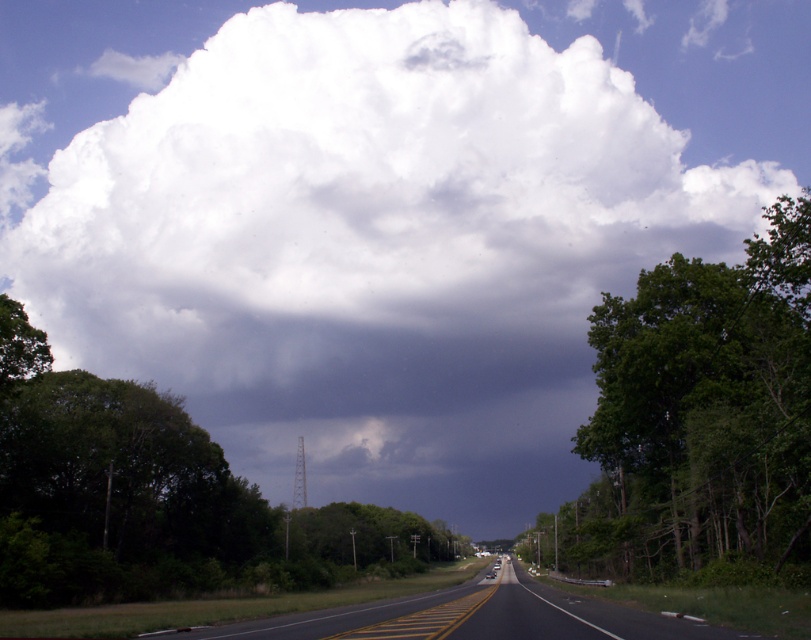
You are a truck driver planning to park your vehicle temporarily. You see the green leafy tree at right and the black asphalt highway at center. Which location would provide a wider space for parking your truck?

The green leafy tree at right has a greater width than the black asphalt highway at center, so parking near the green leafy tree at right would offer more space for parking your truck.

You are standing at the center of the road and want to take a photo of the green leafy tree at left. Which direction should you face to capture it in your camera?

The green leafy tree at left is located at point (153, 499), which is to the left side of the road. Therefore, you should face towards the left direction to capture it in your camera.